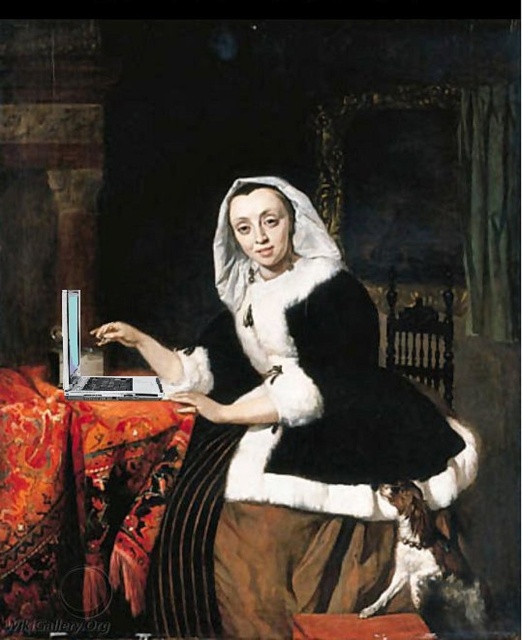
Question: Which of the following is the farthest from the observer?

Choices:
 (A) (79, 381)
 (B) (13, 404)

Answer: (A)

Question: Which object is farther from the camera taking this photo?

Choices:
 (A) metallic silver laptop at left
 (B) silky red cloth at lower left

Answer: (B)

Question: Is silky red cloth at lower left bigger than silver metallic laptop at center?

Choices:
 (A) no
 (B) yes

Answer: (B)

Question: Which of the following is the closest to the observer?

Choices:
 (A) silky red cloth at lower left
 (B) metallic silver laptop at left

Answer: (B)

Question: Is metallic silver laptop at left above silky red cloth at lower left?

Choices:
 (A) yes
 (B) no

Answer: (A)

Question: In this image, where is metallic silver laptop at left located relative to silky red cloth at lower left?

Choices:
 (A) right
 (B) left

Answer: (A)